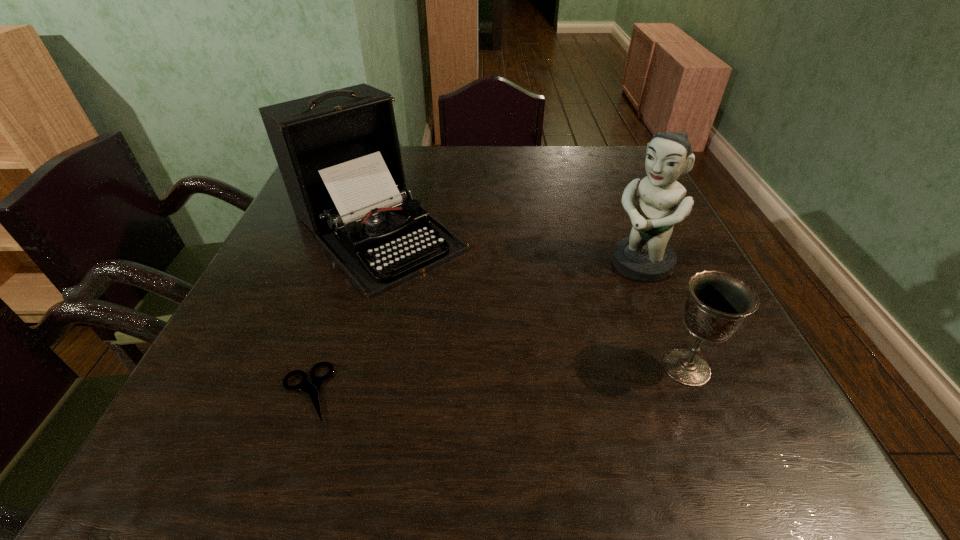
This screenshot has height=540, width=960. What are the coordinates of `the shortest object` in the screenshot? It's located at (312, 389).

I want to click on chalice, so click(x=717, y=305).

You are a GUI agent. You are given a task and a screenshot of the screen. Output one action in this format:
    pyautogui.click(x=<x>, y=<y>)
    Task: Click on the typewriter
    The image size is (960, 540).
    Given the screenshot: What is the action you would take?
    pyautogui.click(x=338, y=152)

This screenshot has width=960, height=540. I want to click on figurine, so click(645, 255).

Image resolution: width=960 pixels, height=540 pixels. In order to click on vacant space located on the back of the shortest object in this screenshot , I will do `click(348, 273)`.

Find the location of a particular element. The image size is (960, 540). free space located 0.100m on the back of the chalice is located at coordinates (660, 306).

This screenshot has height=540, width=960. Identify the location of free location located 0.230m inside the open case of the typewriter. point(498,349).

At what (x,y) coordinates should I click in order to perform the action: click on vacant space located inside the open case of the typewriter. Please return your answer as a coordinate pair (x, y). This screenshot has height=540, width=960. Looking at the image, I should click on (545, 394).

Identify the location of vacant point located inside the open case of the typewriter. (468, 320).

Locate an element on the screen. Image resolution: width=960 pixels, height=540 pixels. vacant area situated on the front-facing side of the figurine is located at coordinates (556, 332).